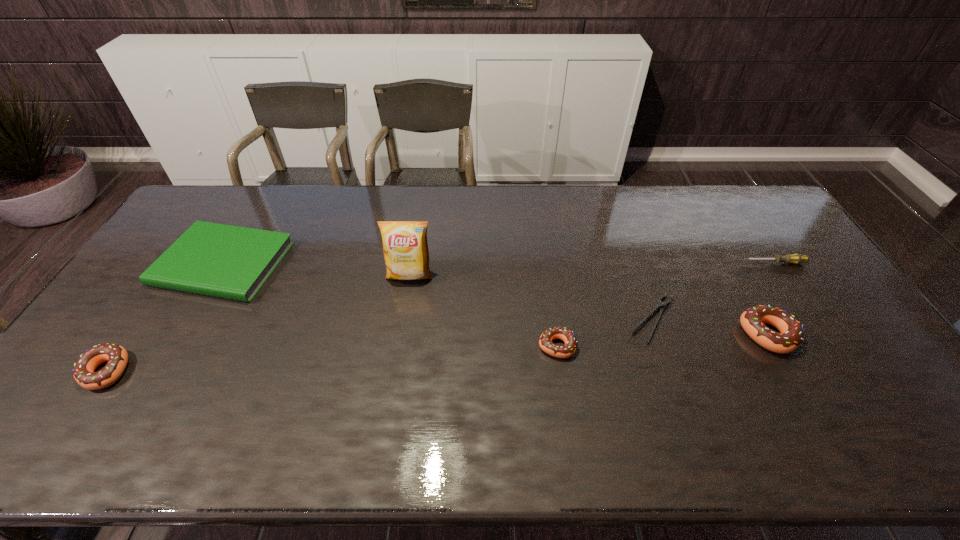
Find the location of a particular element. The height and width of the screenshot is (540, 960). object that can be found as the fourth closest to the shortest doughnut is located at coordinates (796, 258).

Choose which doughnut is the nearest neighbor to the leftmost doughnut. Please provide its 2D coordinates. Your answer should be formatted as a tuple, i.e. [(x, y)], where the tuple contains the x and y coordinates of a point satisfying the conditions above.

[(569, 349)]

The image size is (960, 540). Identify the location of the third closest doughnut relative to the tongs. (83, 371).

This screenshot has width=960, height=540. I want to click on free space that satisfies the following two spatial constraints: 1. on the back side of the fifth object from left to right; 2. on the right side of the second shortest doughnut, so click(141, 319).

Locate an element on the screen. This screenshot has width=960, height=540. free space that satisfies the following two spatial constraints: 1. at the tip of the screwdriver; 2. on the front-facing side of the third object from left to right is located at coordinates (782, 275).

The height and width of the screenshot is (540, 960). Find the location of `vacant space that satisfies the following two spatial constraints: 1. on the front side of the second tallest object; 2. on the right side of the paperback book`. vacant space that satisfies the following two spatial constraints: 1. on the front side of the second tallest object; 2. on the right side of the paperback book is located at coordinates [182, 335].

Locate an element on the screen. The image size is (960, 540). vacant space that satisfies the following two spatial constraints: 1. on the front side of the third object from right to left; 2. on the right side of the paperback book is located at coordinates (191, 319).

Identify the location of vacant region that satisfies the following two spatial constraints: 1. on the front-facing side of the tallest object; 2. on the left side of the fourth object from right to left. The image size is (960, 540). (398, 346).

Identify the location of vacant space that satisfies the following two spatial constraints: 1. at the tip of the screwdriver; 2. on the front side of the fifth object from left to right. The width and height of the screenshot is (960, 540). point(811,319).